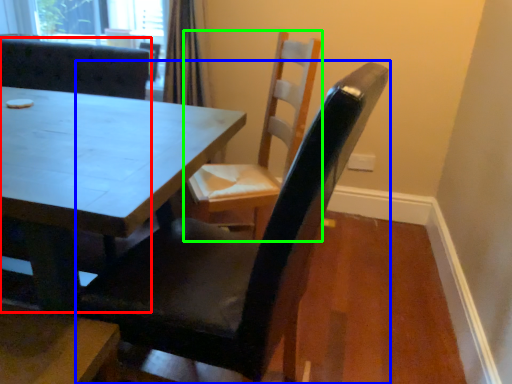
Question: Which object is the closest to the chair (highlighted by a red box)? Choose among these: chair (highlighted by a blue box) or chair (highlighted by a green box).

Choices:
 (A) chair
 (B) chair

Answer: (B)